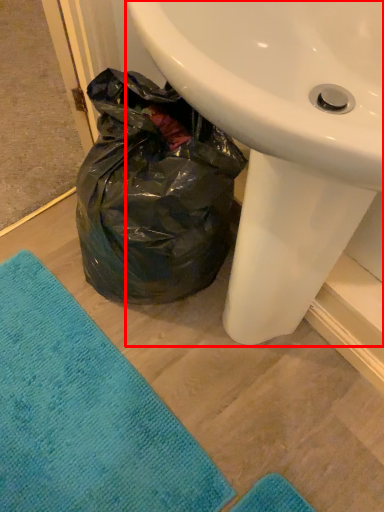
Question: Observing the image, what is the correct spatial positioning of sink (annotated by the red box) in reference to beach towel?

Choices:
 (A) left
 (B) right

Answer: (B)